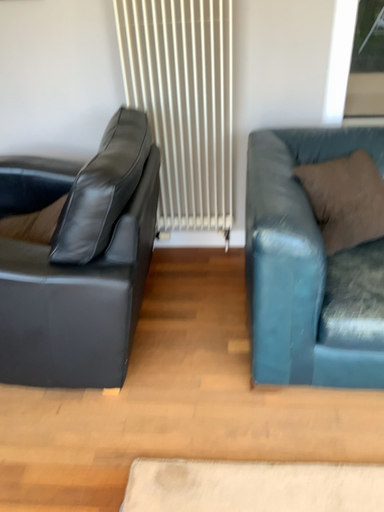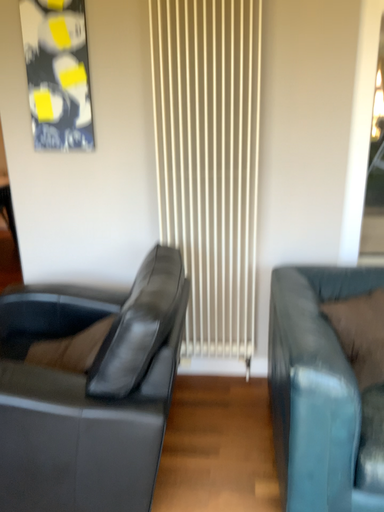
Question: How did the camera likely rotate when shooting the video?

Choices:
 (A) rotated downward
 (B) rotated upward

Answer: (B)